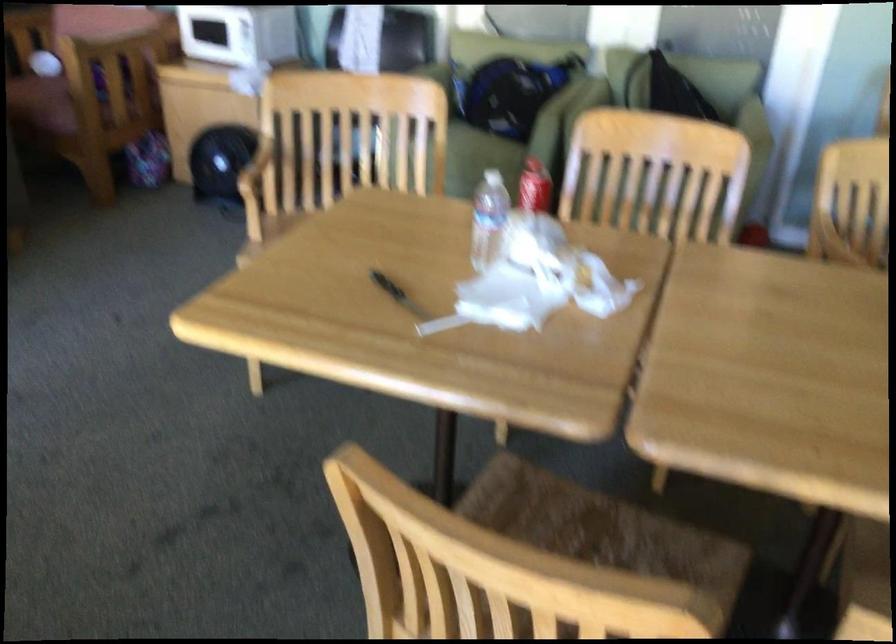
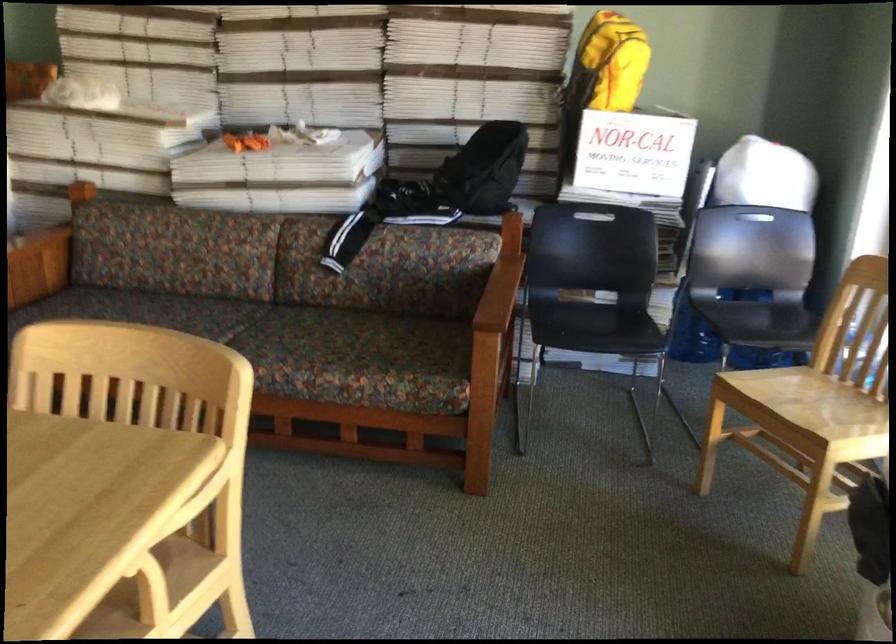
The first image is from the beginning of the video and the second image is from the end. How did the camera likely rotate when shooting the video?

The camera's rotation is toward right-down.